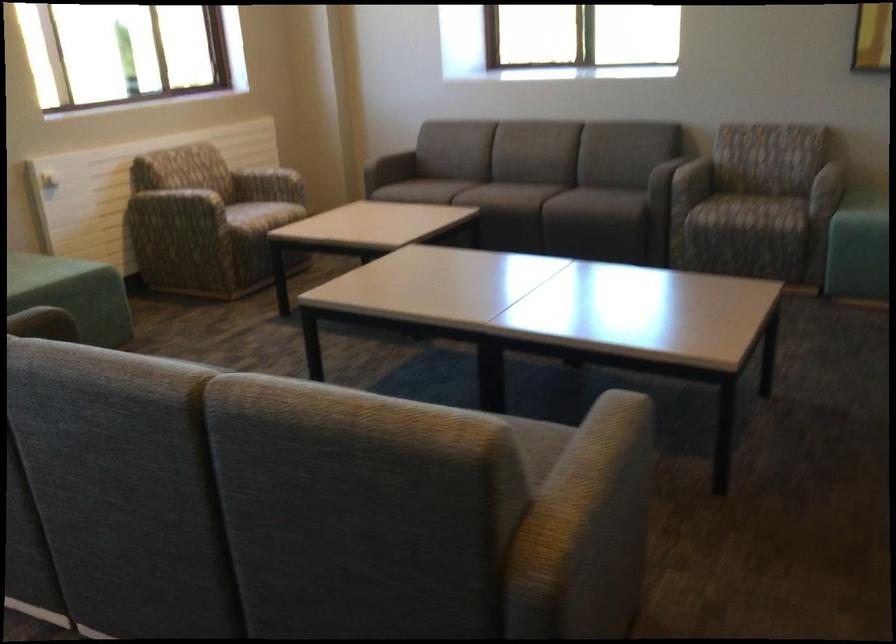
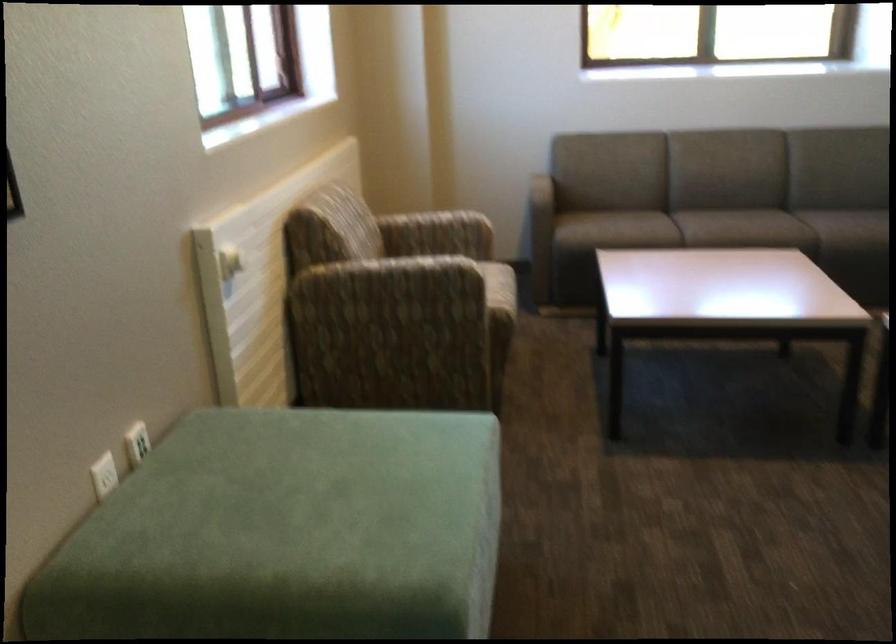
Find the pixel in the second image that matches (161,225) in the first image.

(386, 312)